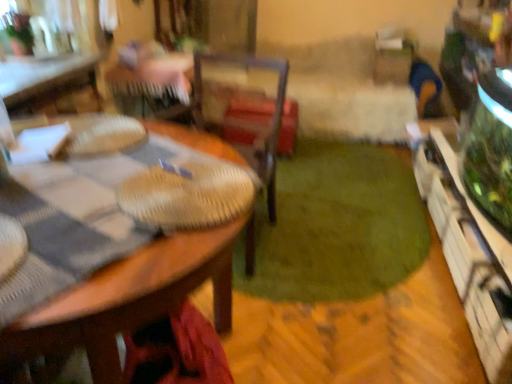
Question: From their relative heights in the image, would you say woven wood chair at center is taller or shorter than green plush carpet at center?

Choices:
 (A) tall
 (B) short

Answer: (A)

Question: Choose the correct answer: Is woven wood chair at center inside green plush carpet at center or outside it?

Choices:
 (A) outside
 (B) inside

Answer: (A)

Question: Which object is the closest to the wooden table at center, which is counted as the 2th table, starting from the top?

Choices:
 (A) woven wood chair at center
 (B) wooden table at upper left, placed as the first table when sorted from top to bottom
 (C) green plush carpet at center

Answer: (A)

Question: Considering the real-world distances, which object is closest to the wooden table at upper left, placed as the first table when sorted from top to bottom?

Choices:
 (A) woven wood chair at center
 (B) green plush carpet at center
 (C) wooden table at center, which is counted as the 2th table, starting from the top

Answer: (A)